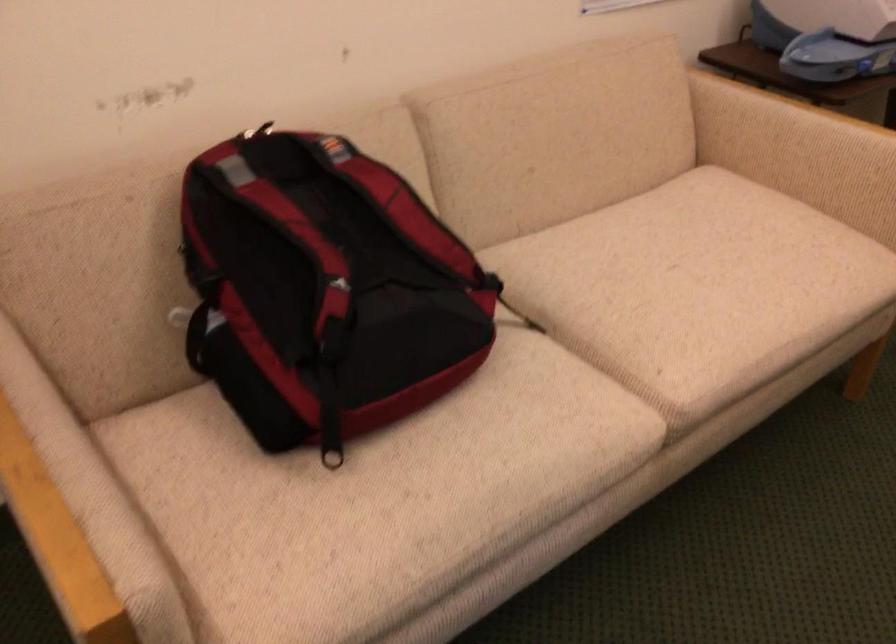
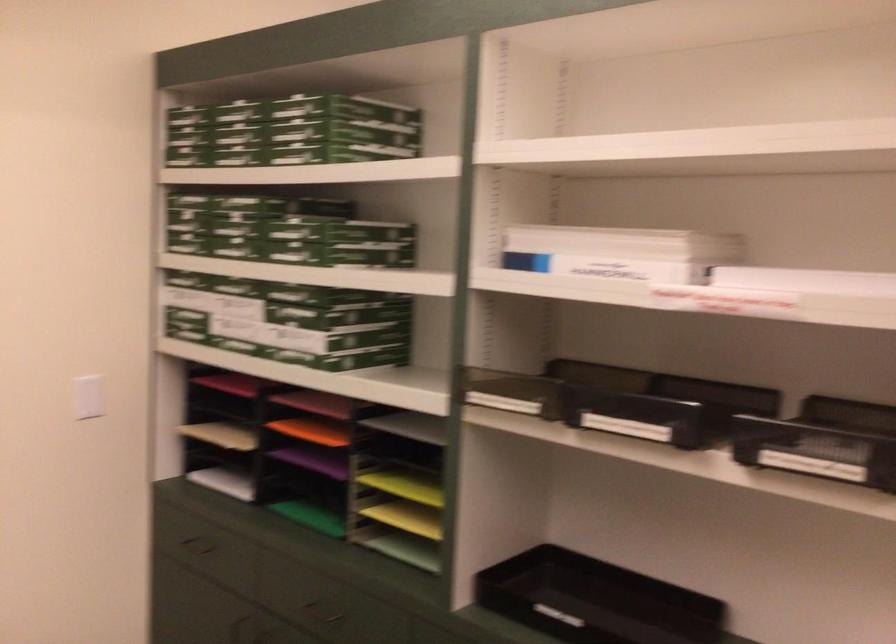
Question: The camera is either moving clockwise (left) or counter-clockwise (right) around the object. The first image is from the beginning of the video and the second image is from the end. Is the camera moving left or right when shooting the video?

Choices:
 (A) Left
 (B) Right

Answer: (A)